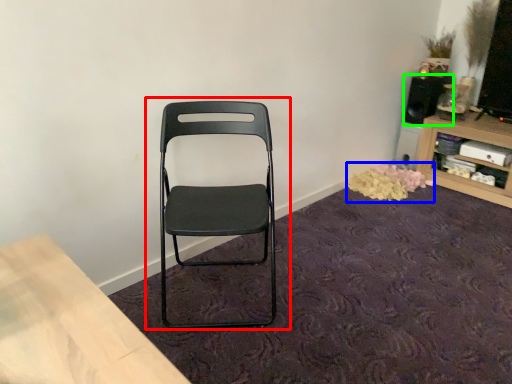
Question: Based on their relative distances, which object is farther from chair (highlighted by a red box)? Choose from flower (highlighted by a blue box) and speaker (highlighted by a green box).

Choices:
 (A) flower
 (B) speaker

Answer: (B)